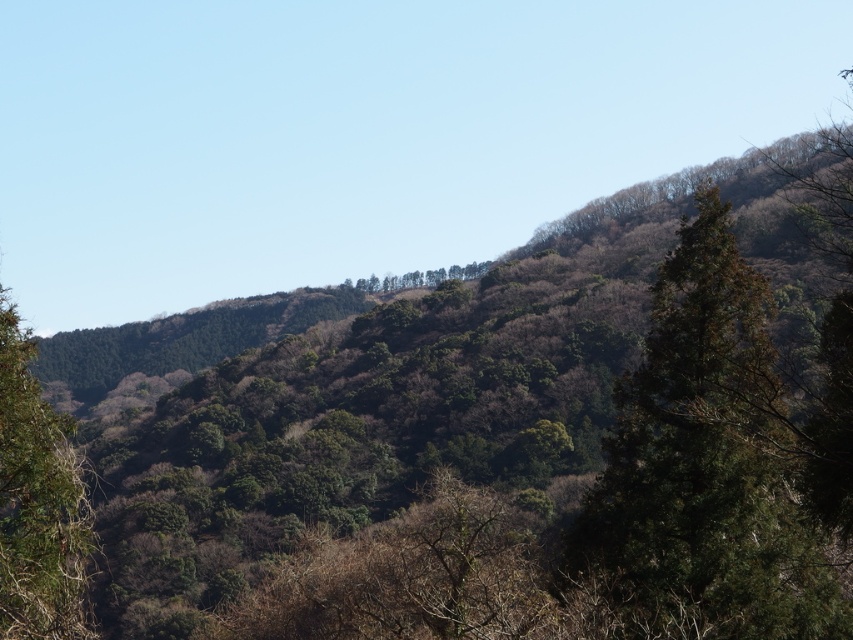
Question: Based on their relative distances, which object is farther from the dark green textured tree at upper right?

Choices:
 (A) green leafy trees at center
 (B) green leafy tree at left

Answer: (A)

Question: Is dark green textured tree at upper right above green leafy tree at left?

Choices:
 (A) yes
 (B) no

Answer: (B)

Question: Does dark green textured tree at upper right lie in front of green leafy trees at center?

Choices:
 (A) yes
 (B) no

Answer: (A)

Question: Which object appears farthest from the camera in this image?

Choices:
 (A) dark green textured tree at upper right
 (B) green leafy tree at left
 (C) green leafy trees at center

Answer: (C)

Question: Which point is closer to the camera?

Choices:
 (A) (776, 604)
 (B) (78, 627)
 (C) (431, 282)

Answer: (B)

Question: Does dark green textured tree at upper right have a greater width compared to green leafy tree at left?

Choices:
 (A) no
 (B) yes

Answer: (B)